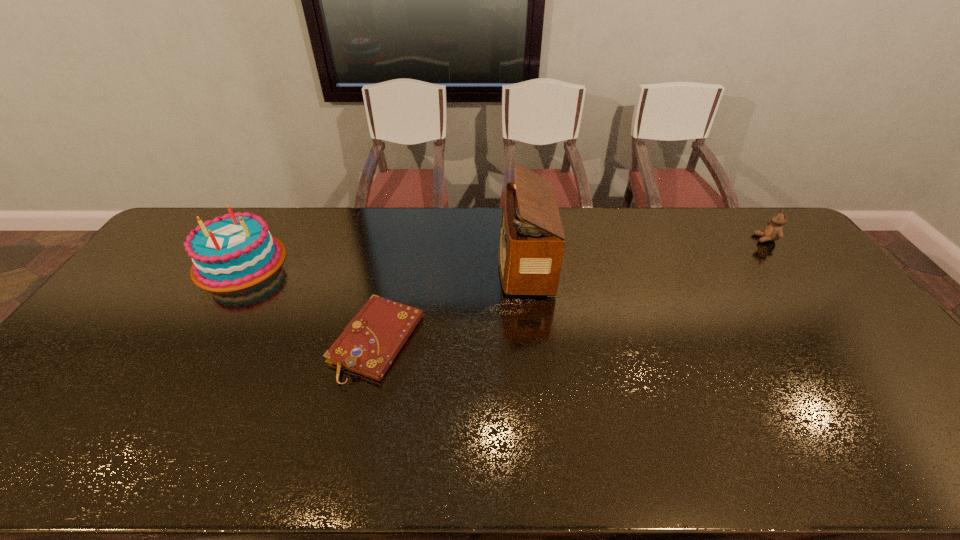
Find the location of `radio receiver`. radio receiver is located at coordinates (531, 246).

The width and height of the screenshot is (960, 540). Identify the location of the tallest object. (531, 246).

The image size is (960, 540). Identify the location of the third shortest object. (236, 251).

The height and width of the screenshot is (540, 960). What are the coordinates of `birthday cake` in the screenshot? It's located at (236, 251).

Identify the location of the second shortest object. coord(774,231).

Identify the location of the rightmost object. (774, 231).

Find the location of `notebook`. notebook is located at coordinates (370, 342).

Identify the location of the shortest object. The height and width of the screenshot is (540, 960). (370, 342).

I want to click on vacant space located on the front panel of the radio receiver, so click(x=468, y=262).

You are a GUI agent. You are given a task and a screenshot of the screen. Output one action in this format:
    pyautogui.click(x=<x>, y=<y>)
    Task: Click on the free space located on the front panel of the radio receiver
    Image resolution: width=960 pixels, height=540 pixels.
    Given the screenshot: What is the action you would take?
    pyautogui.click(x=462, y=262)